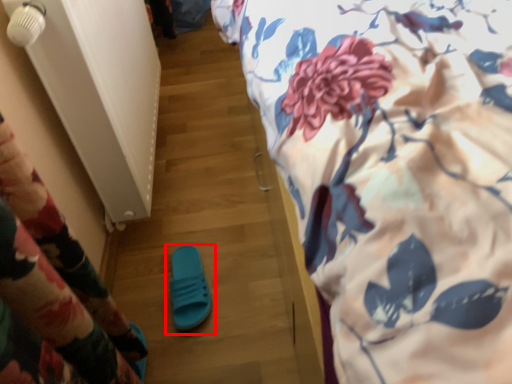
Question: In this image, where is footwear (annotated by the red box) located relative to bed?

Choices:
 (A) left
 (B) right

Answer: (A)